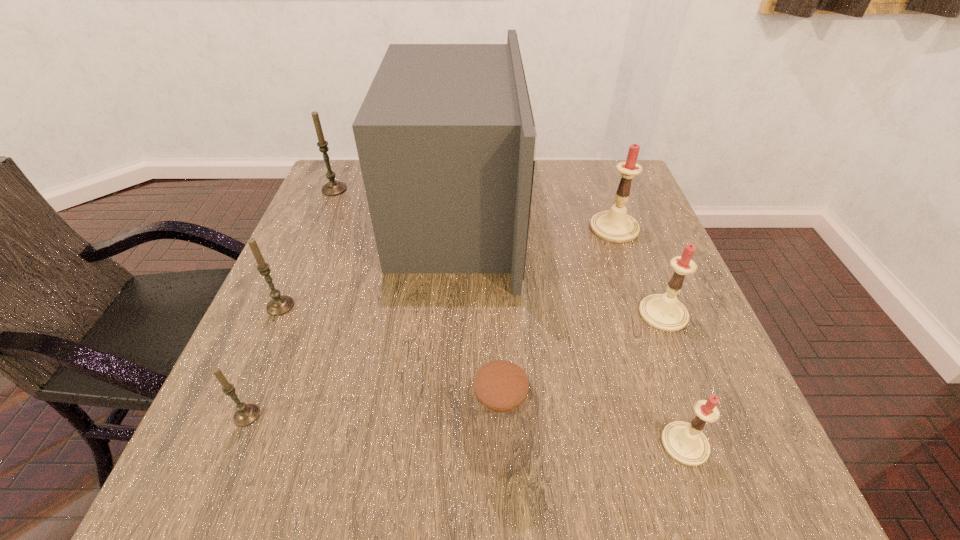
Where is `candle present at the far edge`? candle present at the far edge is located at coordinates (332, 188).

The height and width of the screenshot is (540, 960). Find the location of `jar situated at the near edge`. jar situated at the near edge is located at coordinates (499, 407).

Where is `candle at the near edge`? This screenshot has width=960, height=540. candle at the near edge is located at coordinates (685, 442).

The height and width of the screenshot is (540, 960). Find the location of `object at the far left corner`. object at the far left corner is located at coordinates (332, 188).

Image resolution: width=960 pixels, height=540 pixels. What are the coordinates of `object positioned at the near right corner` in the screenshot? It's located at (685, 442).

Where is `free location at the far edge of the desktop`? The image size is (960, 540). free location at the far edge of the desktop is located at coordinates (568, 172).

In order to click on vacant space at the near edge of the desktop in this screenshot , I will do `click(392, 465)`.

This screenshot has height=540, width=960. What are the coordinates of `free space at the left edge of the desktop` in the screenshot? It's located at [256, 388].

At what (x,y) coordinates should I click in order to perform the action: click on vacant space at the far left corner of the desktop. Please return your answer as a coordinate pair (x, y). Looking at the image, I should click on (341, 173).

In the image, there is a desktop. What are the coordinates of `vacant space at the near left corner` in the screenshot? It's located at (266, 468).